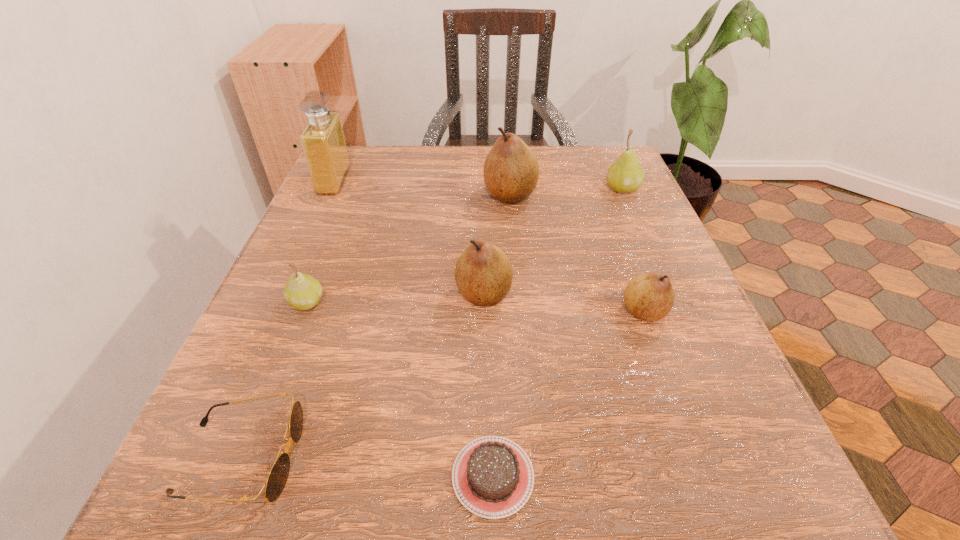
At what (x,y) coordinates should I click in order to perform the action: click on the tallest object. Please return your answer as a coordinate pair (x, y). Image resolution: width=960 pixels, height=540 pixels. Looking at the image, I should click on click(323, 142).

Identify the location of the tallest pear. (511, 171).

Find the location of `the farthest brown pear`. the farthest brown pear is located at coordinates (511, 171).

Locate an element on the screen. The height and width of the screenshot is (540, 960). the right green pear is located at coordinates (626, 175).

Image resolution: width=960 pixels, height=540 pixels. Find the location of `the bigger green pear`. the bigger green pear is located at coordinates (626, 175).

Identify the location of the second smallest brown pear. Image resolution: width=960 pixels, height=540 pixels. (483, 273).

The height and width of the screenshot is (540, 960). I want to click on the smallest brown pear, so click(x=650, y=296).

At what (x,y) coordinates should I click in order to perform the action: click on the smaller green pear. Please return your answer as a coordinate pair (x, y). The image size is (960, 540). Looking at the image, I should click on (302, 291).

Where is `the left green pear`? the left green pear is located at coordinates (302, 291).

I want to click on black sunglasses, so click(x=278, y=475).